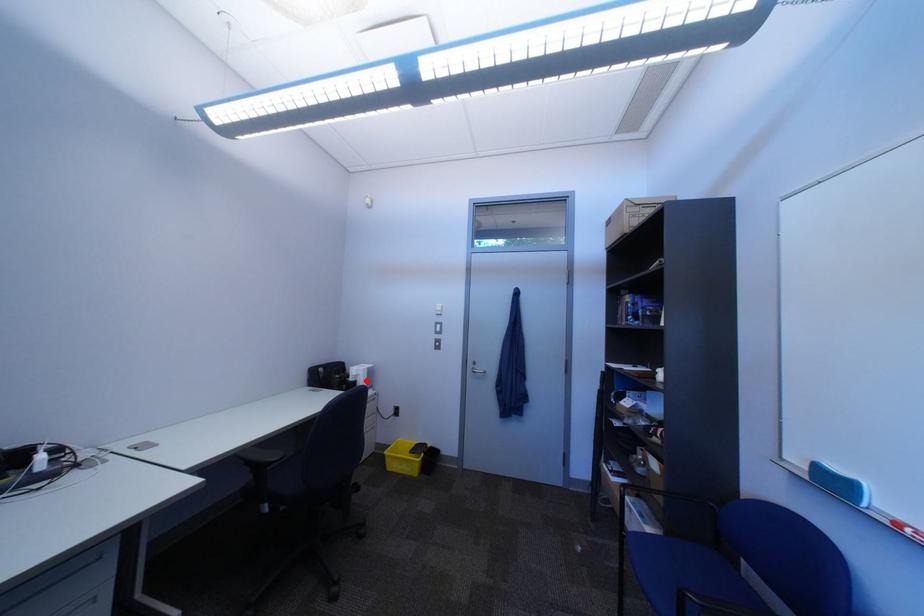
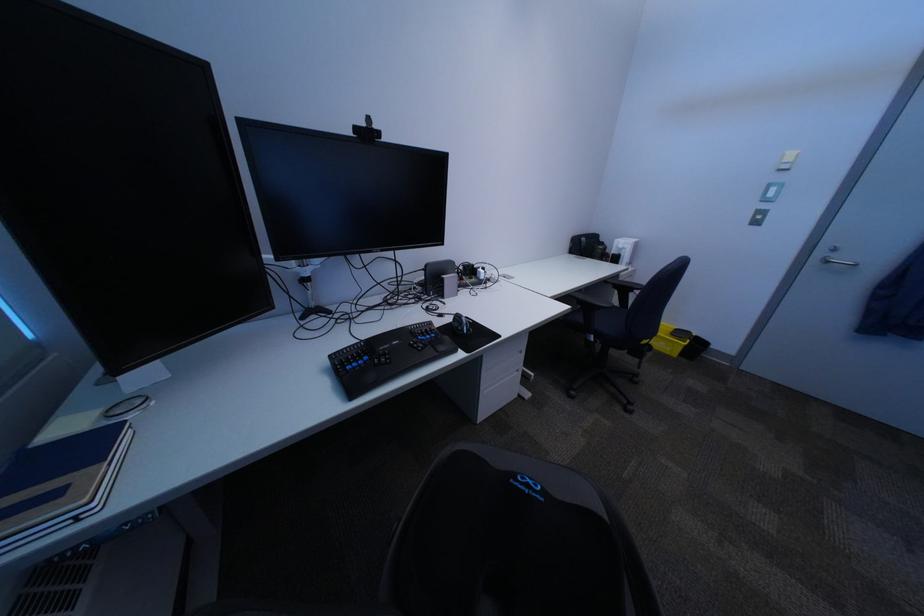
Question: I am providing you with two images of the same scene from different viewpoints. A red point is marked on the first image. At the location where the point appears in image 1, is it still visible in image 2?

Choices:
 (A) Yes
 (B) No

Answer: (A)